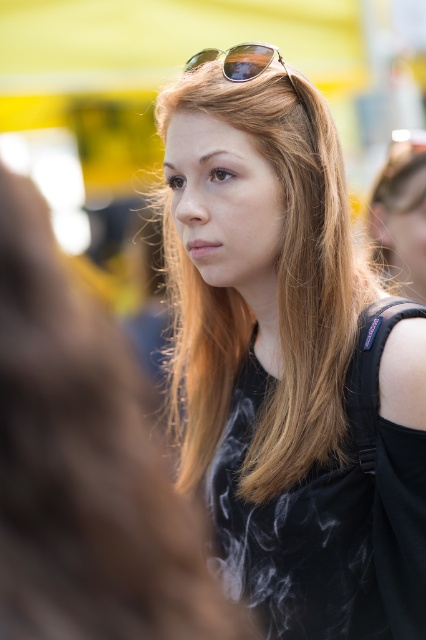
Based on the scene description, can you determine which object is higher in position between the smooth brown hair at center and the gold reflective sunglasses at upper center?

The smooth brown hair at center is taller than the gold reflective sunglasses at upper center.

You are taking a photo of the woman in the scene. You notice two points marked in the image. The first point is at coordinates point (241, 173) and the second is at point (46, 273). Which point is closer to the camera?

Point (46, 273) is closer to the camera than point (241, 173) because the description states that point (241, 173) is further away.

You are a photographer trying to capture the woman in the scene. Since the matte black shirt at center and the gold reflective sunglasses at upper center are both in the frame, which one should you focus on to ensure the subject is properly centered in your shot?

The matte black shirt at center is below the gold reflective sunglasses at upper center. To properly center the subject, focus on the matte black shirt at center as it is positioned at the central area of the image.